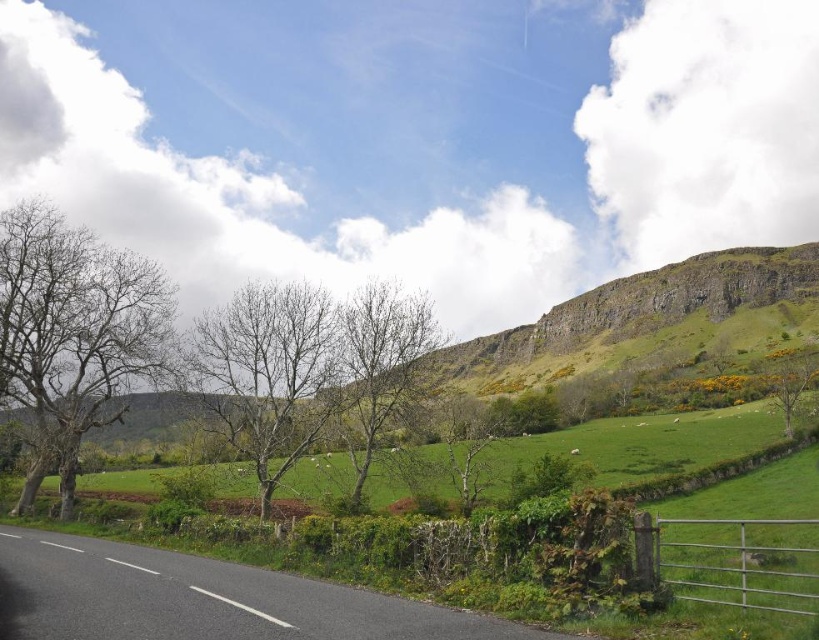
Question: Among these points, which one is farthest from the camera?

Choices:
 (A) (240, 436)
 (B) (467, 397)
 (C) (342, 349)

Answer: (B)

Question: Which object is positioned farthest from the bare wood tree at center?

Choices:
 (A) bare branches at left
 (B) bare wood at center

Answer: (A)

Question: Estimate the real-world distances between objects in this image. Which object is farther from the bare wood at center?

Choices:
 (A) bare wood tree at center
 (B) bare branches at left

Answer: (B)

Question: Is bare wood at center closer to camera compared to bare wood tree at center?

Choices:
 (A) yes
 (B) no

Answer: (A)

Question: Can you confirm if bare branches at left is positioned above bare branches at center?

Choices:
 (A) no
 (B) yes

Answer: (B)

Question: Is bare branches at left further to camera compared to bare branches at center?

Choices:
 (A) yes
 (B) no

Answer: (A)